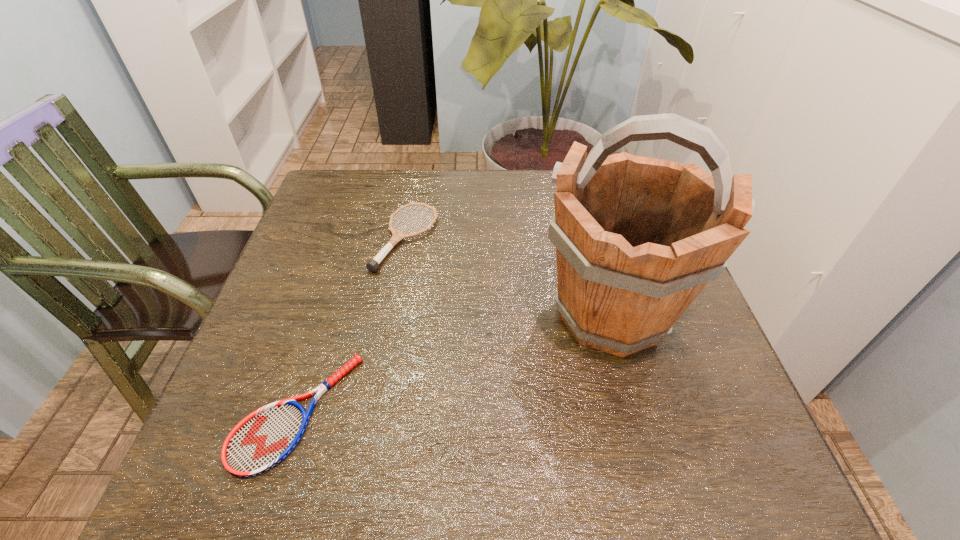
The image size is (960, 540). Identify the location of blank space that satisfies the following two spatial constraints: 1. on the front side of the taller tennis racket; 2. on the right side of the rightmost object. click(392, 314).